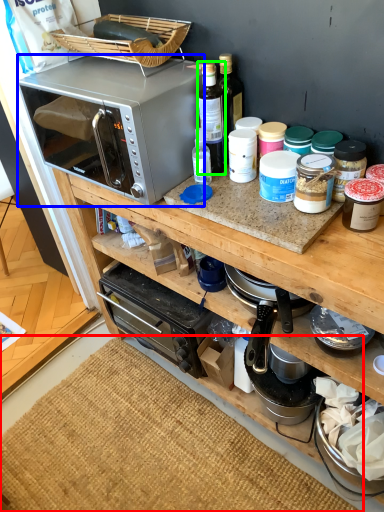
Question: Estimate the real-world distances between objects in this image. Which object is farther from mat (highlighted by a red box), microwave oven (highlighted by a blue box) or bottle (highlighted by a green box)?

Choices:
 (A) microwave oven
 (B) bottle

Answer: (B)